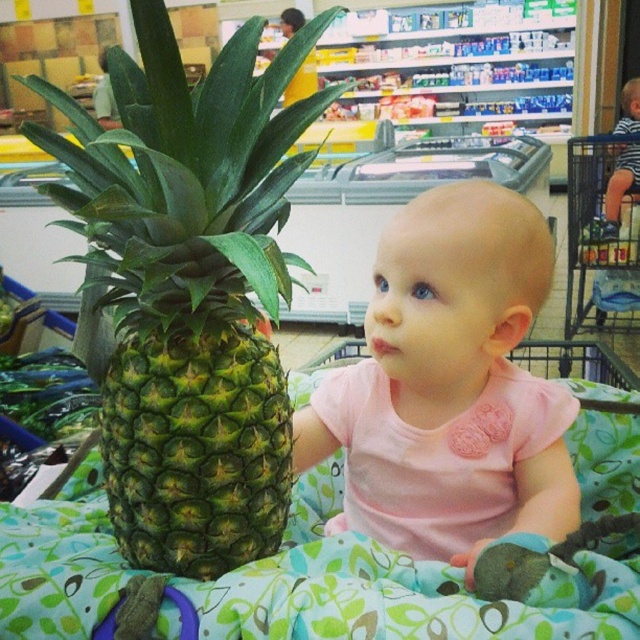
The width and height of the screenshot is (640, 640). What do you see at coordinates (189, 289) in the screenshot?
I see `green textured pineapple at center` at bounding box center [189, 289].

Does green textured pineapple at center appear over pink fabric baby at center?

Correct, green textured pineapple at center is located above pink fabric baby at center.

Locate an element on the screen. The width and height of the screenshot is (640, 640). green textured pineapple at center is located at coordinates (189, 289).

Does pink fabric baby at center have a larger size compared to metallic blue shopping cart at upper right?

Incorrect, pink fabric baby at center is not larger than metallic blue shopping cart at upper right.

Does pink fabric baby at center have a greater width compared to metallic blue shopping cart at upper right?

In fact, pink fabric baby at center might be narrower than metallic blue shopping cart at upper right.

Which is in front, point (483, 516) or point (612, 310)?

Point (483, 516) is more forward.

The image size is (640, 640). Identify the location of pink fabric baby at center. (451, 384).

Which is more to the right, green textured pineapple at center or metallic blue shopping cart at upper right?

Positioned to the right is metallic blue shopping cart at upper right.

Which is below, green textured pineapple at center or metallic blue shopping cart at upper right?

green textured pineapple at center is below.

Is point (218, 180) farther from camera compared to point (611, 266)?

No, it is in front of (611, 266).

Where is `green textured pineapple at center`? This screenshot has width=640, height=640. green textured pineapple at center is located at coordinates (189, 289).